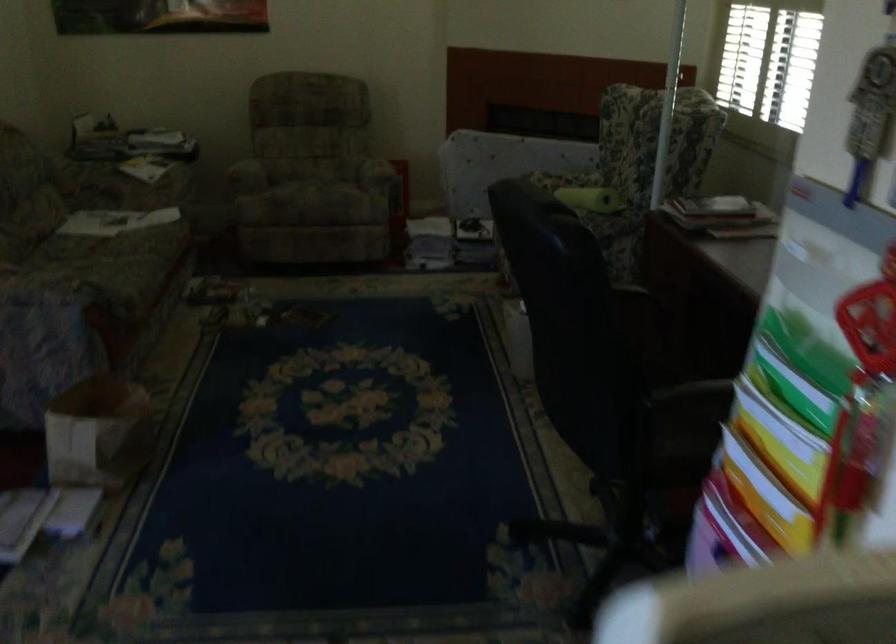
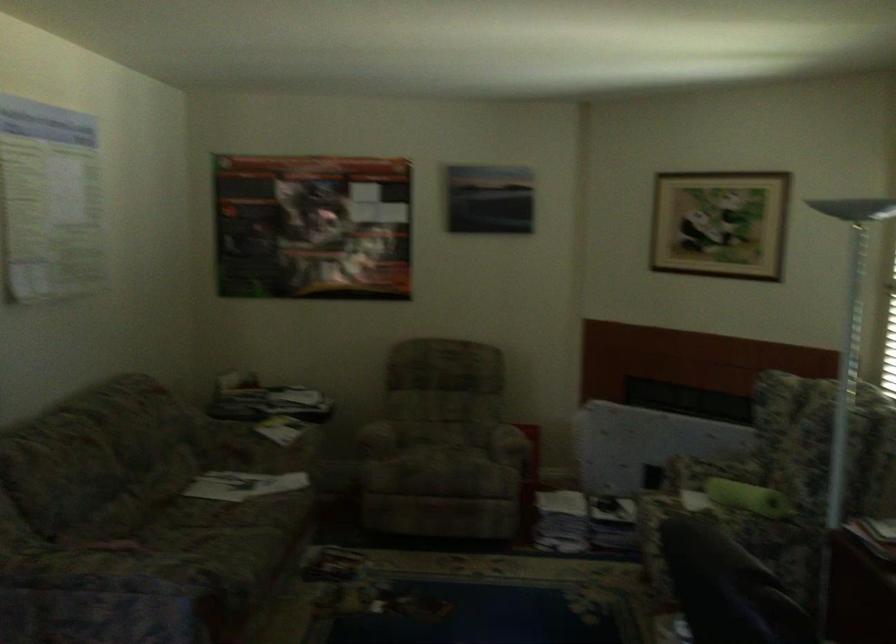
In the second image, find the point that corresponds to (x=83, y=213) in the first image.

(217, 488)